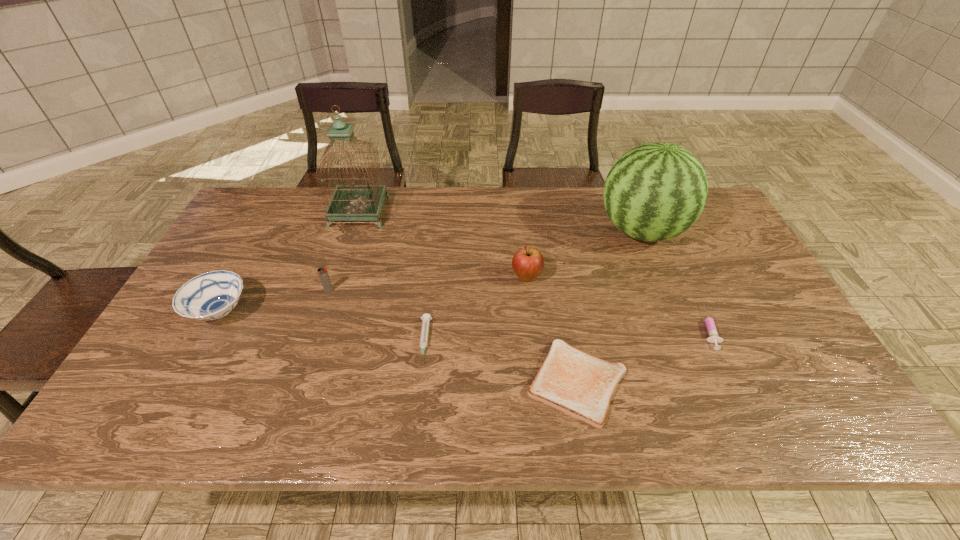
This screenshot has height=540, width=960. Find the location of `birdcage`. birdcage is located at coordinates (352, 202).

In order to click on watermelon in this screenshot , I will do `click(654, 192)`.

The image size is (960, 540). I want to click on the sixth shortest object, so click(527, 263).

At what (x,y) coordinates should I click in order to perform the action: click on the sixth nearest object. Please return your answer as a coordinate pair (x, y). Looking at the image, I should click on (527, 263).

Where is `igniter`? The width and height of the screenshot is (960, 540). igniter is located at coordinates (323, 274).

Locate an element on the screen. The image size is (960, 540). the leftmost object is located at coordinates (212, 295).

Locate an element on the screen. This screenshot has width=960, height=540. the right syringe is located at coordinates (710, 324).

The height and width of the screenshot is (540, 960). What are the coordinates of `the left syringe` in the screenshot? It's located at (426, 318).

The height and width of the screenshot is (540, 960). In order to click on the shortest object in this screenshot , I will do 581,385.

Where is `vacant space located at the door of the birdcage`? This screenshot has height=540, width=960. vacant space located at the door of the birdcage is located at coordinates (482, 212).